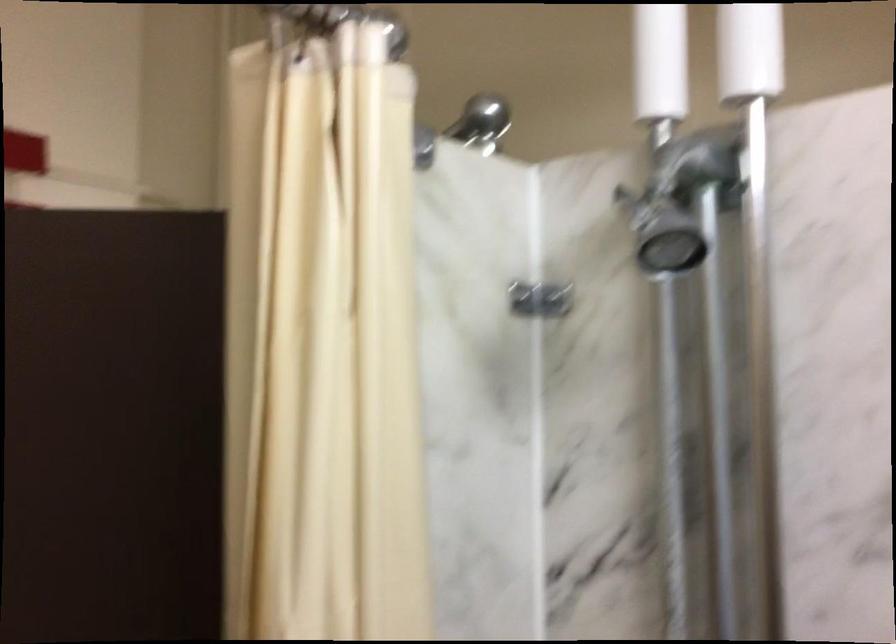
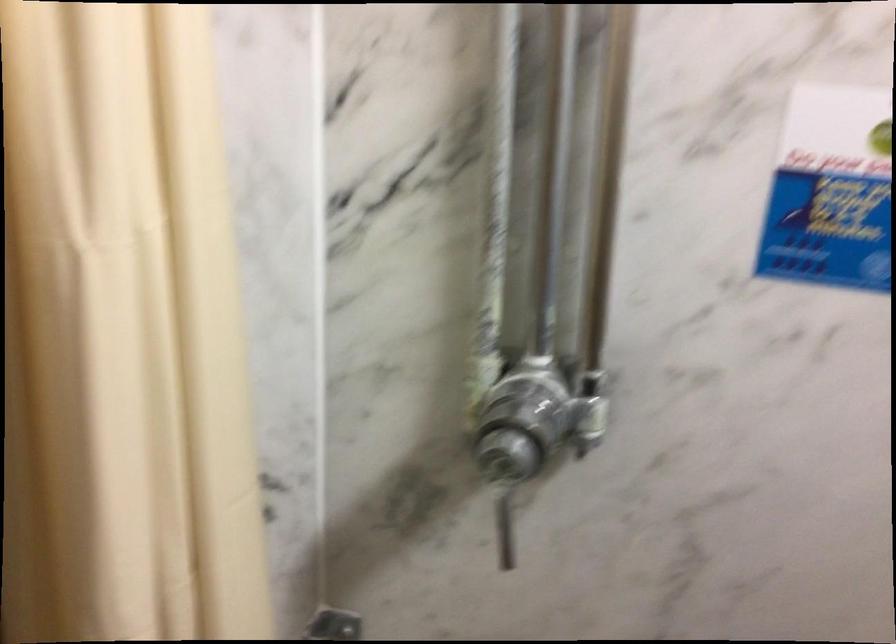
First-person continuous shooting, in which direction is the camera rotating?

The camera rotated toward right-down.